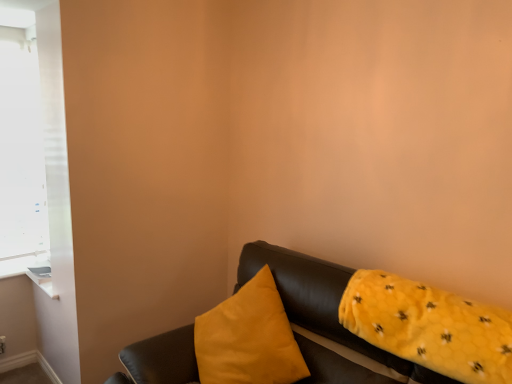
Based on the photo, what is the approximate height of leather couch at lower right?

leather couch at lower right is 37.64 inches in height.

What are the coordinates of `leather couch at lower right` in the screenshot? It's located at (325, 318).

Do you think white matte window at upper left is within leather couch at lower right, or outside of it?

white matte window at upper left cannot be found inside leather couch at lower right.

Is there a large distance between white matte window at upper left and leather couch at lower right?

Absolutely, white matte window at upper left is distant from leather couch at lower right.

From a real-world perspective, does white matte window at upper left sit lower than leather couch at lower right?

No, from a real-world perspective, white matte window at upper left is not under leather couch at lower right.

Considering the positions of objects white matte window at upper left and leather couch at lower right in the image provided, who is in front, white matte window at upper left or leather couch at lower right?

leather couch at lower right.

From a real-world perspective, is yellow fuzzy pillow at right, arranged as the second pillow when viewed from the left, on top of matte yellow pillow at center, the second pillow positioned from the right?

Answer: Indeed, from a real-world perspective, yellow fuzzy pillow at right, arranged as the second pillow when viewed from the left, stands above matte yellow pillow at center, the second pillow positioned from the right.

Considering their positions, is yellow fuzzy pillow at right, arranged as the second pillow when viewed from the left, located in front of or behind matte yellow pillow at center, the second pillow positioned from the right?

In the image, yellow fuzzy pillow at right, arranged as the second pillow when viewed from the left, appears in front of matte yellow pillow at center, the second pillow positioned from the right.

In the scene shown: Is yellow fuzzy pillow at right, the 1th pillow in the right-to-left sequence, far from matte yellow pillow at center, the second pillow positioned from the right?

No, yellow fuzzy pillow at right, the 1th pillow in the right-to-left sequence, is not far from matte yellow pillow at center, the second pillow positioned from the right.

From the image's perspective, is yellow fuzzy pillow at right, arranged as the second pillow when viewed from the left, located above or below leather couch at lower right?

From the image's perspective, yellow fuzzy pillow at right, arranged as the second pillow when viewed from the left, appears above leather couch at lower right.

Is point (350, 320) closer or farther from the camera than point (423, 375)?

Point (350, 320) appears to be farther away from the viewer than point (423, 375).

From their relative heights in the image, would you say yellow fuzzy pillow at right, arranged as the second pillow when viewed from the left, is taller or shorter than leather couch at lower right?

Clearly, yellow fuzzy pillow at right, arranged as the second pillow when viewed from the left, is shorter compared to leather couch at lower right.

Find the location of a particular element. Image resolution: width=512 pixels, height=384 pixels. studio couch below the yellow fuzzy pillow at right, arranged as the second pillow when viewed from the left (from the image's perspective) is located at coordinates (325, 318).

From a real-world perspective, relative to yellow fuzzy pillow at right, the 1th pillow in the right-to-left sequence, is white matte window at upper left vertically above or below?

white matte window at upper left is situated higher than yellow fuzzy pillow at right, the 1th pillow in the right-to-left sequence, in the real world.

How different are the orientations of white matte window at upper left and yellow fuzzy pillow at right, the 1th pillow in the right-to-left sequence, in degrees?

The angle between the facing direction of white matte window at upper left and the facing direction of yellow fuzzy pillow at right, the 1th pillow in the right-to-left sequence, is 90 degrees.

Would you say yellow fuzzy pillow at right, arranged as the second pillow when viewed from the left, is part of white matte window at upper left's contents?

No, yellow fuzzy pillow at right, arranged as the second pillow when viewed from the left, is not a part of white matte window at upper left.

Between point (342, 284) and point (500, 323), which one is positioned behind?

Positioned behind is point (342, 284).

Is leather couch at lower right taller or shorter than yellow fuzzy pillow at right, arranged as the second pillow when viewed from the left?

In the image, leather couch at lower right appears to be taller than yellow fuzzy pillow at right, arranged as the second pillow when viewed from the left.

Which is in front, point (261, 345) or point (1, 32)?

Positioned in front is point (261, 345).

In terms of size, does matte yellow pillow at center, the second pillow positioned from the right, appear bigger or smaller than white matte window at upper left?

In the image, matte yellow pillow at center, the second pillow positioned from the right, appears to be larger than white matte window at upper left.

At what (x,y) coordinates should I click in order to perform the action: click on the 1st pillow in front when counting from the white matte window at upper left. Please return your answer as a coordinate pair (x, y). The image size is (512, 384). Looking at the image, I should click on click(x=248, y=338).

From the image's perspective, would you say matte yellow pillow at center, the first pillow positioned from the left, is positioned over white matte window at upper left?

No, from the image's perspective, matte yellow pillow at center, the first pillow positioned from the left, is not over white matte window at upper left.

Is white matte window at upper left aimed at matte yellow pillow at center, the first pillow positioned from the left?

No, white matte window at upper left is not oriented towards matte yellow pillow at center, the first pillow positioned from the left.

How many degrees apart are the facing directions of white matte window at upper left and matte yellow pillow at center, the first pillow positioned from the left?

The angular difference between white matte window at upper left and matte yellow pillow at center, the first pillow positioned from the left, is 91.2 degrees.

Which of these two, white matte window at upper left or matte yellow pillow at center, the second pillow positioned from the right, stands shorter?

With less height is matte yellow pillow at center, the second pillow positioned from the right.

Is matte yellow pillow at center, the second pillow positioned from the right, located within white matte window at upper left?

No, matte yellow pillow at center, the second pillow positioned from the right, is not inside white matte window at upper left.

Identify the location of studio couch on the right of white matte window at upper left. Image resolution: width=512 pixels, height=384 pixels. (325, 318).

Where is `pillow lying below the yellow fuzzy pillow at right, arranged as the second pillow when viewed from the left (from the image's perspective)`? The height and width of the screenshot is (384, 512). pillow lying below the yellow fuzzy pillow at right, arranged as the second pillow when viewed from the left (from the image's perspective) is located at coordinates (248, 338).

Considering their positions, is yellow fuzzy pillow at right, the 1th pillow in the right-to-left sequence, positioned further to white matte window at upper left than leather couch at lower right?

The object further to white matte window at upper left is yellow fuzzy pillow at right, the 1th pillow in the right-to-left sequence.

Looking at the image, which one is located closer to leather couch at lower right, matte yellow pillow at center, the second pillow positioned from the right, or white matte window at upper left?

matte yellow pillow at center, the second pillow positioned from the right, is closer to leather couch at lower right.

Based on their spatial positions, is yellow fuzzy pillow at right, the 1th pillow in the right-to-left sequence, or matte yellow pillow at center, the second pillow positioned from the right, further from white matte window at upper left?

Among the two, yellow fuzzy pillow at right, the 1th pillow in the right-to-left sequence, is located further to white matte window at upper left.

Which object lies further to the anchor point yellow fuzzy pillow at right, the 1th pillow in the right-to-left sequence, leather couch at lower right or white matte window at upper left?

Based on the image, white matte window at upper left appears to be further to yellow fuzzy pillow at right, the 1th pillow in the right-to-left sequence.

From the image, which object appears to be nearer to yellow fuzzy pillow at right, the 1th pillow in the right-to-left sequence, white matte window at upper left or matte yellow pillow at center, the second pillow positioned from the right?

matte yellow pillow at center, the second pillow positioned from the right.

Looking at the image, which one is located further to matte yellow pillow at center, the first pillow positioned from the left, yellow fuzzy pillow at right, arranged as the second pillow when viewed from the left, or white matte window at upper left?

Among the two, white matte window at upper left is located further to matte yellow pillow at center, the first pillow positioned from the left.

Based on their spatial positions, is yellow fuzzy pillow at right, arranged as the second pillow when viewed from the left, or matte yellow pillow at center, the first pillow positioned from the left, further from leather couch at lower right?

Based on the image, matte yellow pillow at center, the first pillow positioned from the left, appears to be further to leather couch at lower right.

From the image, which object appears to be nearer to matte yellow pillow at center, the first pillow positioned from the left, yellow fuzzy pillow at right, arranged as the second pillow when viewed from the left, or leather couch at lower right?

Based on the image, leather couch at lower right appears to be nearer to matte yellow pillow at center, the first pillow positioned from the left.

The image size is (512, 384). In order to click on pillow between leather couch at lower right and matte yellow pillow at center, the first pillow positioned from the left, in the front-back direction in this screenshot , I will do `click(429, 326)`.

Identify the location of studio couch between white matte window at upper left and yellow fuzzy pillow at right, arranged as the second pillow when viewed from the left. (325, 318).

You are a GUI agent. You are given a task and a screenshot of the screen. Output one action in this format:
    pyautogui.click(x=<x>, y=<y>)
    Task: Click on the pillow situated between white matte window at upper left and yellow fuzzy pillow at right, the 1th pillow in the right-to-left sequence, from left to right
    This screenshot has height=384, width=512.
    Given the screenshot: What is the action you would take?
    click(x=248, y=338)

Find the location of a particular element. This screenshot has height=384, width=512. pillow located between white matte window at upper left and leather couch at lower right in the left-right direction is located at coordinates (248, 338).